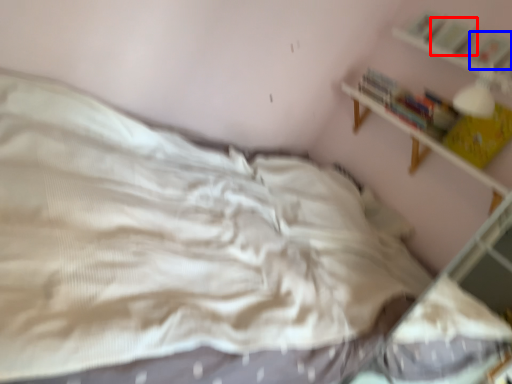
Question: Which object appears closest to the camera in this image, book (highlighted by a red box) or book (highlighted by a blue box)?

Choices:
 (A) book
 (B) book

Answer: (B)